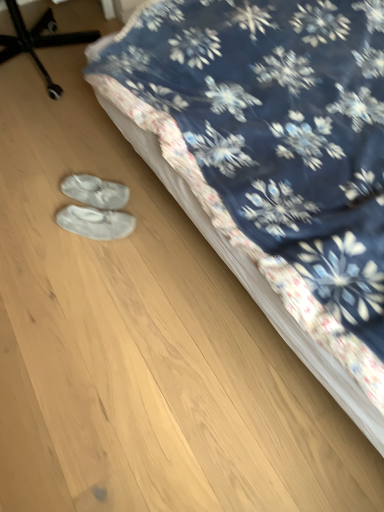
Question: Based on their sizes in the image, would you say floral fabric bed at center is bigger or smaller than white fabric shoe covers at lower left, which ranks as the first footwear in top-to-bottom order?

Choices:
 (A) big
 (B) small

Answer: (A)

Question: From the image's perspective, is floral fabric bed at center above or below white fabric shoe covers at lower left, which ranks as the first footwear in top-to-bottom order?

Choices:
 (A) below
 (B) above

Answer: (B)

Question: Based on their relative distances, which object is nearer to the floral fabric bed at center?

Choices:
 (A) black plastic chair at upper left
 (B) white fabric shoe covers at lower left, which ranks as the first footwear in top-to-bottom order
 (C) white suede slippers at lower center, the first footwear from the bottom

Answer: (C)

Question: Estimate the real-world distances between objects in this image. Which object is closer to the white suede slippers at lower center, which is the second footwear from top to bottom?

Choices:
 (A) white fabric shoe covers at lower left, arranged as the second footwear when ordered from the bottom
 (B) floral fabric bed at center
 (C) black plastic chair at upper left

Answer: (A)